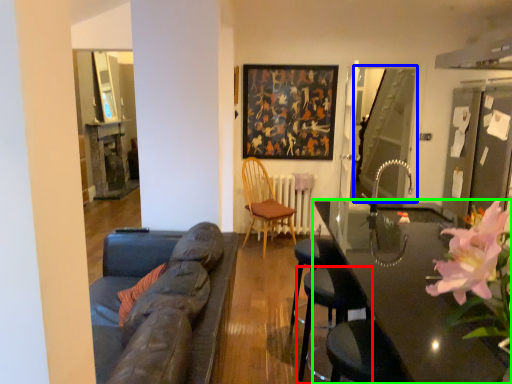
Question: Considering the real-world distances, which object is farthest from chair (highlighted by a red box)? glass door (highlighted by a blue box) or table (highlighted by a green box)?

Choices:
 (A) glass door
 (B) table

Answer: (A)